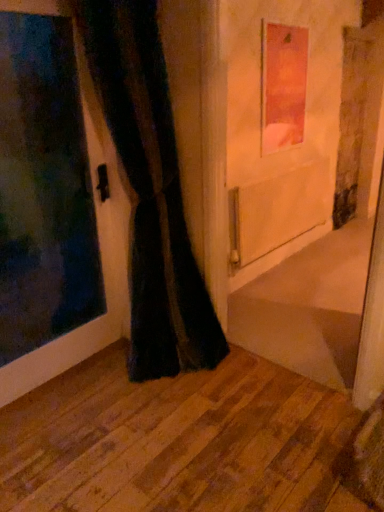
The width and height of the screenshot is (384, 512). In order to click on free space above matte pink picture frame at upper center (from a real-world perspective) in this screenshot , I will do `click(288, 22)`.